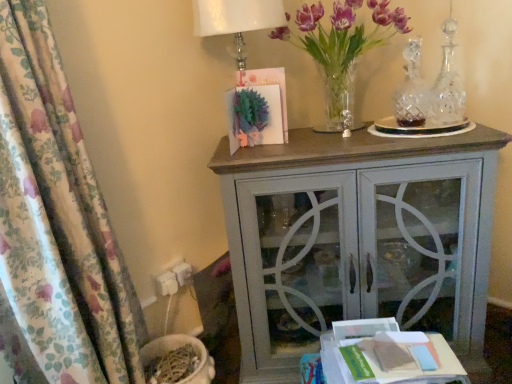
Question: Does purple glass vase at upper right appear on the left side of matte gray cabinet at center?

Choices:
 (A) no
 (B) yes

Answer: (B)

Question: Can you confirm if purple glass vase at upper right is thinner than matte gray cabinet at center?

Choices:
 (A) no
 (B) yes

Answer: (A)

Question: Is purple glass vase at upper right facing towards matte gray cabinet at center?

Choices:
 (A) yes
 (B) no

Answer: (B)

Question: Would you say purple glass vase at upper right is outside matte gray cabinet at center?

Choices:
 (A) yes
 (B) no

Answer: (A)

Question: Can you confirm if purple glass vase at upper right is positioned to the right of matte gray cabinet at center?

Choices:
 (A) no
 (B) yes

Answer: (A)

Question: Is matte gray cabinet at center surrounded by purple glass vase at upper right?

Choices:
 (A) yes
 (B) no

Answer: (B)

Question: Is the position of floral fabric curtain at left more distant than that of white paper at lower right?

Choices:
 (A) no
 (B) yes

Answer: (A)

Question: Is floral fabric curtain at left beside white paper at lower right?

Choices:
 (A) yes
 (B) no

Answer: (B)

Question: Considering the relative sizes of floral fabric curtain at left and white paper at lower right in the image provided, is floral fabric curtain at left thinner than white paper at lower right?

Choices:
 (A) no
 (B) yes

Answer: (B)

Question: Is floral fabric curtain at left turned away from white paper at lower right?

Choices:
 (A) yes
 (B) no

Answer: (B)

Question: From a real-world perspective, is floral fabric curtain at left located higher than white paper at lower right?

Choices:
 (A) yes
 (B) no

Answer: (A)

Question: Does floral fabric curtain at left have a greater height compared to white paper at lower right?

Choices:
 (A) yes
 (B) no

Answer: (A)

Question: From the image's perspective, is floral fabric curtain at left on matte gray cabinet at center?

Choices:
 (A) yes
 (B) no

Answer: (A)